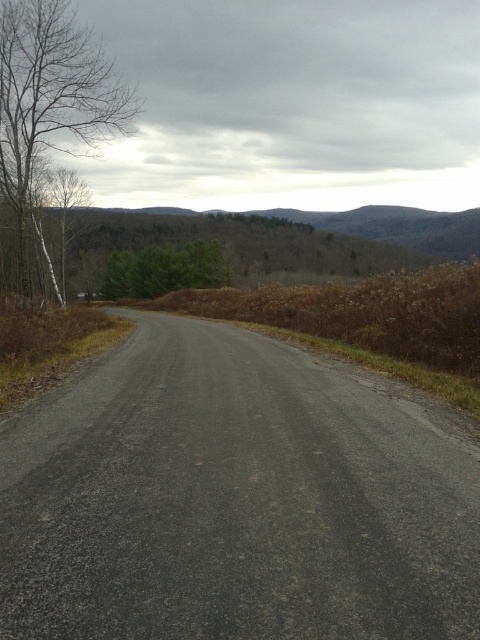
Question: Which object appears closest to the camera in this image?

Choices:
 (A) green matte tree at center
 (B) bare wood tree at left

Answer: (B)

Question: Does bare wood tree at left appear on the left side of green matte tree at center?

Choices:
 (A) yes
 (B) no

Answer: (A)

Question: Estimate the real-world distances between objects in this image. Which object is farther from the green forested mountain at upper center?

Choices:
 (A) green matte tree at center
 (B) bare wood tree at left

Answer: (B)

Question: Does bare wood tree at left have a smaller size compared to green matte tree at center?

Choices:
 (A) no
 (B) yes

Answer: (A)

Question: Is bare wood tree at left in front of green matte tree at center?

Choices:
 (A) no
 (B) yes

Answer: (B)

Question: Considering the real-world distances, which object is farthest from the green matte tree at center?

Choices:
 (A) bare wood tree at left
 (B) green forested mountain at upper center

Answer: (A)